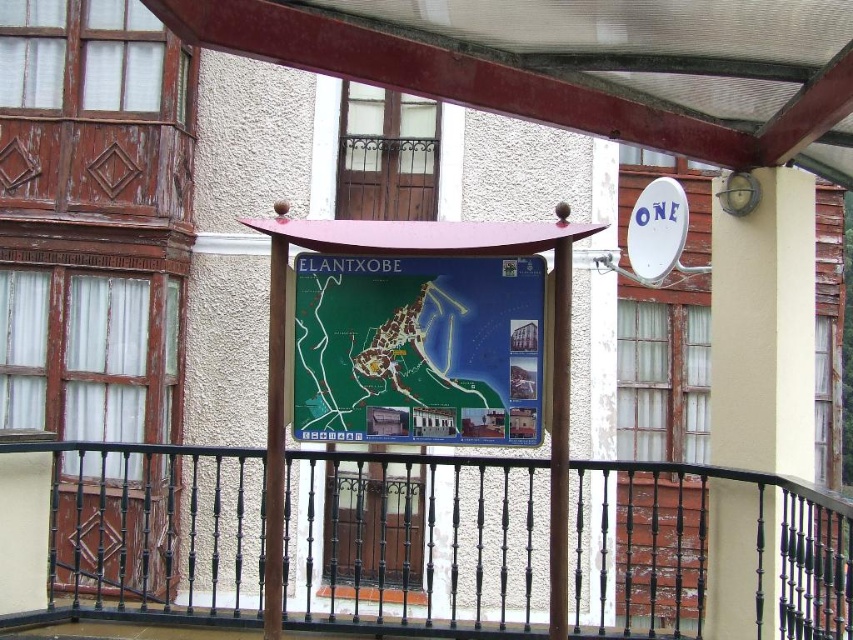
You are standing in front of the building and notice two points marked on the map. The first point is at coordinates point (402,392) and the second is at point (561,508). Which point is closer to you?

Point (402,392) is closer to you because it is further to the viewer than point (561,508).